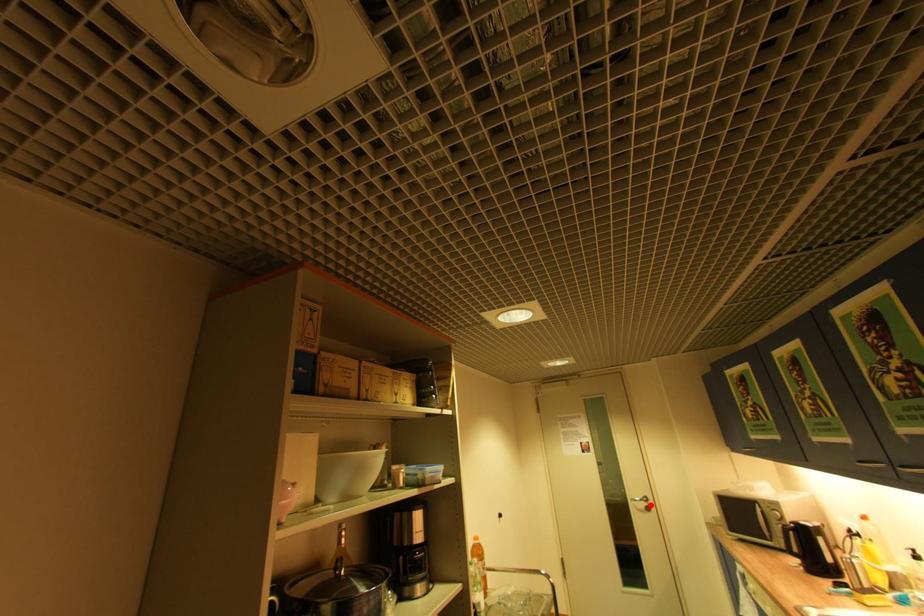
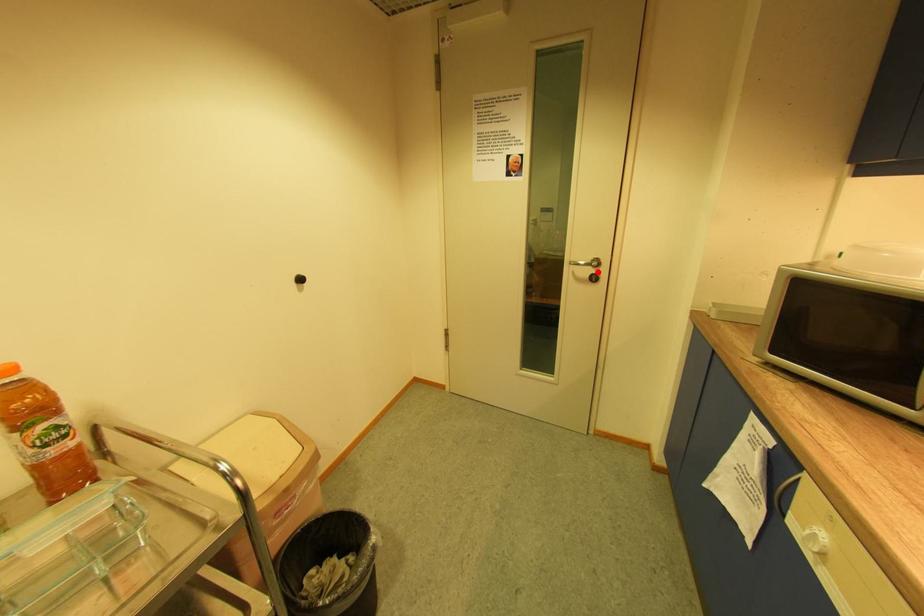
I am providing you with two images of the same scene from different viewpoints. A red point is marked on the first image and another point is marked on the second image. Does the point marked in image1 correspond to the same location as the one in image2?

Yes